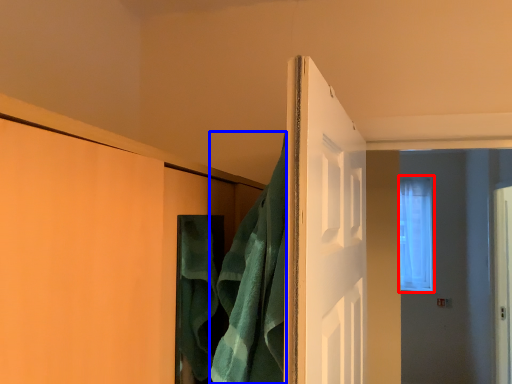
Question: Which point is further to the camera, window (highlighted by a red box) or bath towel (highlighted by a blue box)?

Choices:
 (A) window
 (B) bath towel

Answer: (A)